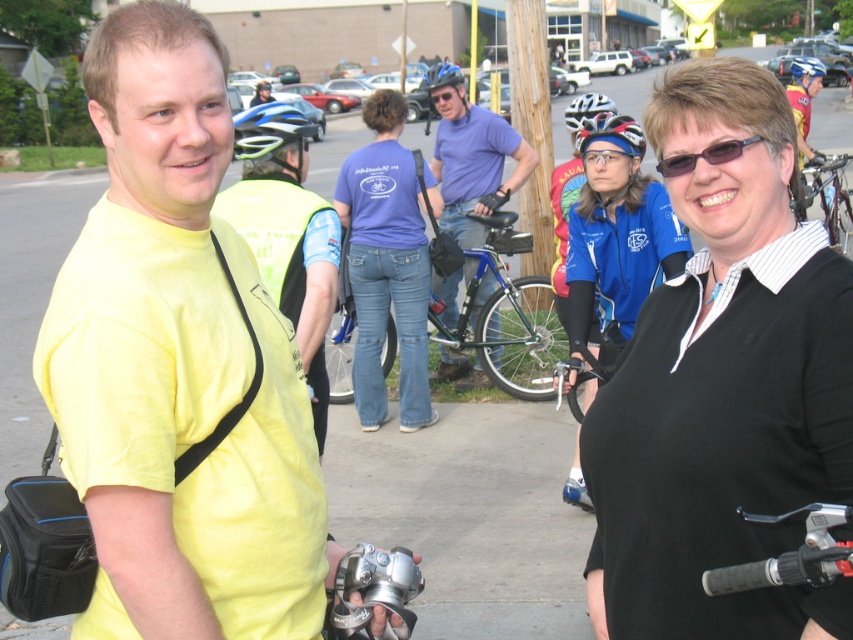
You are organizing a photo shoot and need to ensure that both the yellow matte shirt at center and the blue jersey at center are visible in the frame. Given their sizes, which one might require more space to accommodate in the photo composition?

The yellow matte shirt at center has a larger width than the blue jersey at center, so it would require more space in the photo composition.

You are a photographer at the cycling event and want to take a photo of both the blue jersey at center and the blue metallic bicycle at center. Which object should you focus on first if you want to capture them both in the same frame without moving the camera?

The blue jersey at center is shorter than the blue metallic bicycle at center, so you should focus on the blue metallic bicycle at center first to ensure it fits within the frame since it is taller.

You are standing in the middle of the paved area and want to take a photo of the black matte shirt at center. Which direction should you face to ensure it is in the frame?

The black matte shirt at center is located at point (723, 385), so you should face towards the center area to capture it in your photo.